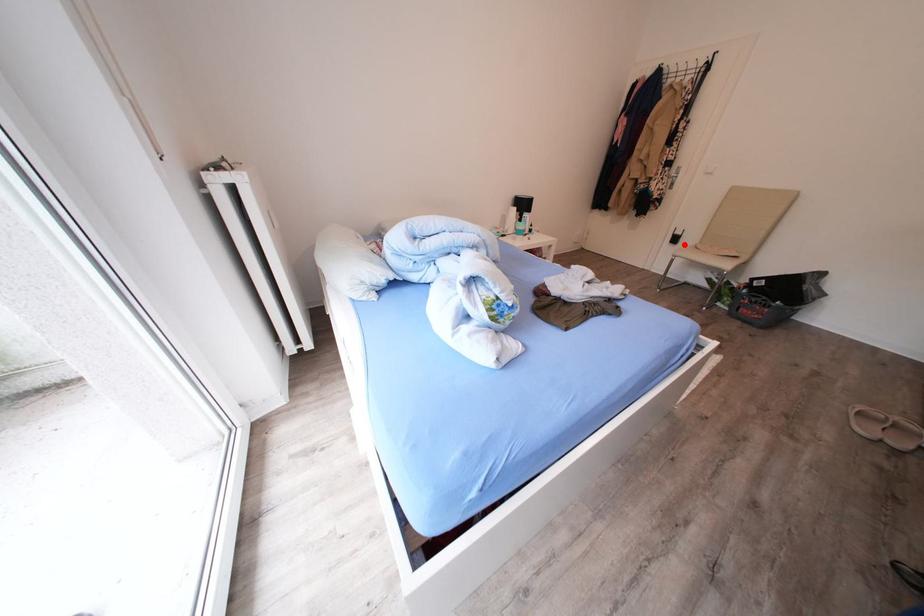
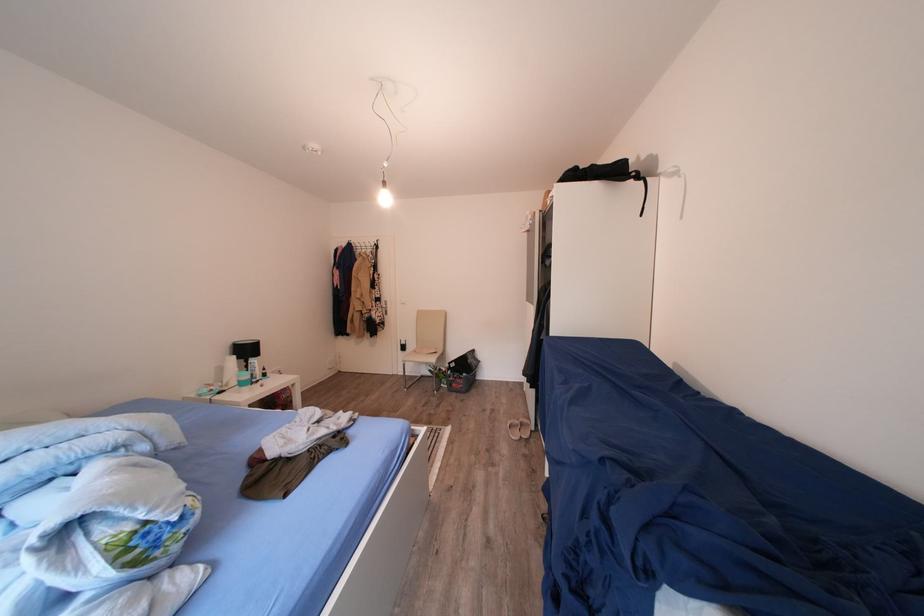
Question: A red point is marked in image1. In image2, is the corresponding 3D point closer to the camera or farther? Reply with the corresponding letter.

Choices:
 (A) The corresponding 3D point is closer.
 (B) The corresponding 3D point is farther.

Answer: (B)